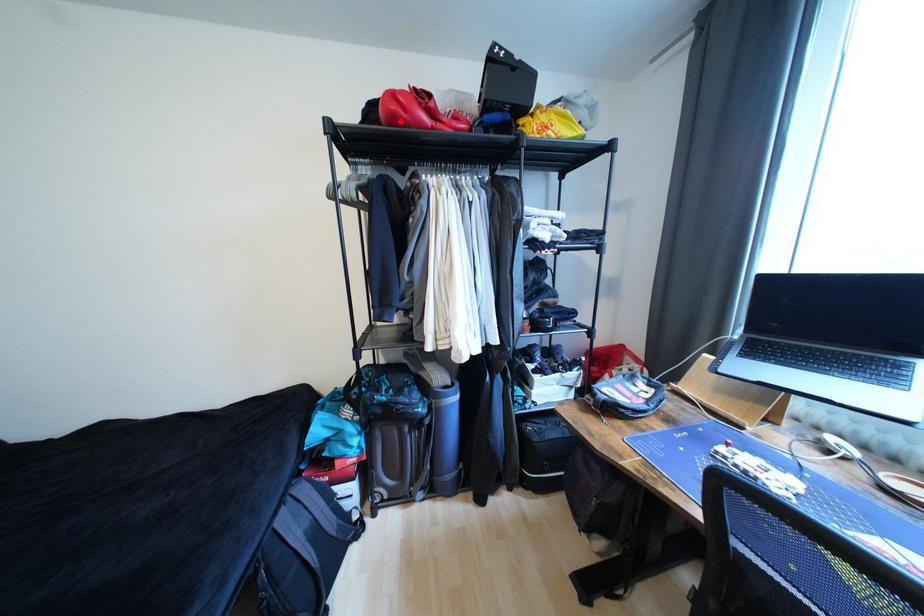
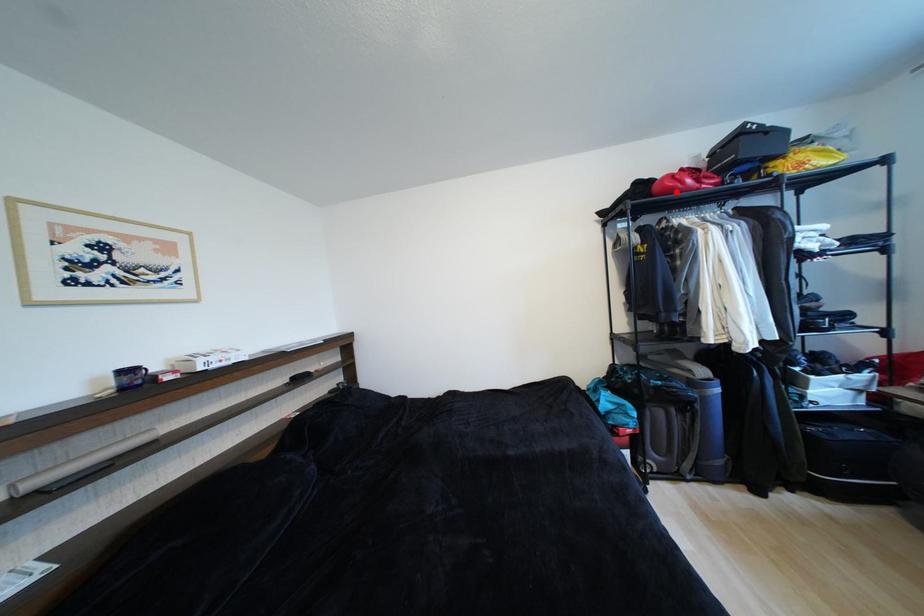
I am providing you with two images of the same scene from different viewpoints. A red point is marked on the first image and another point is marked on the second image. Do the highlighted points in image1 and image2 indicate the same real-world spot?

Yes